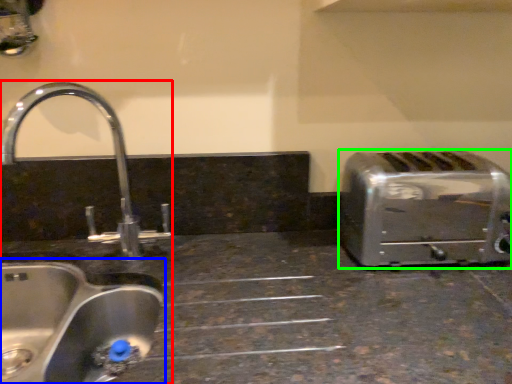
Question: Which object is positioned closest to sink (highlighted by a red box)? Select from sink (highlighted by a blue box) and toaster (highlighted by a green box).

Choices:
 (A) sink
 (B) toaster

Answer: (A)